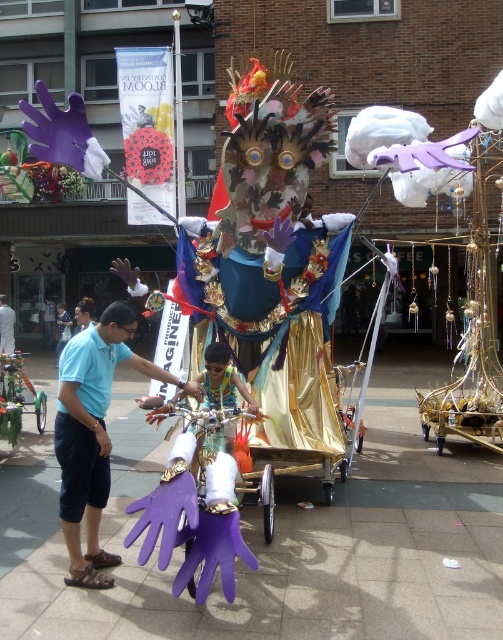
Can you confirm if purple rubber gloves at center is wider than matte blue shirt at left?

Yes, purple rubber gloves at center is wider than matte blue shirt at left.

Between purple rubber gloves at center and matte blue shirt at left, which one appears on the left side from the viewer's perspective?

matte blue shirt at left is more to the left.

What do you see at coordinates (277, 540) in the screenshot?
I see `purple rubber gloves at center` at bounding box center [277, 540].

Locate an element on the screen. The image size is (503, 640). purple rubber gloves at center is located at coordinates (277, 540).